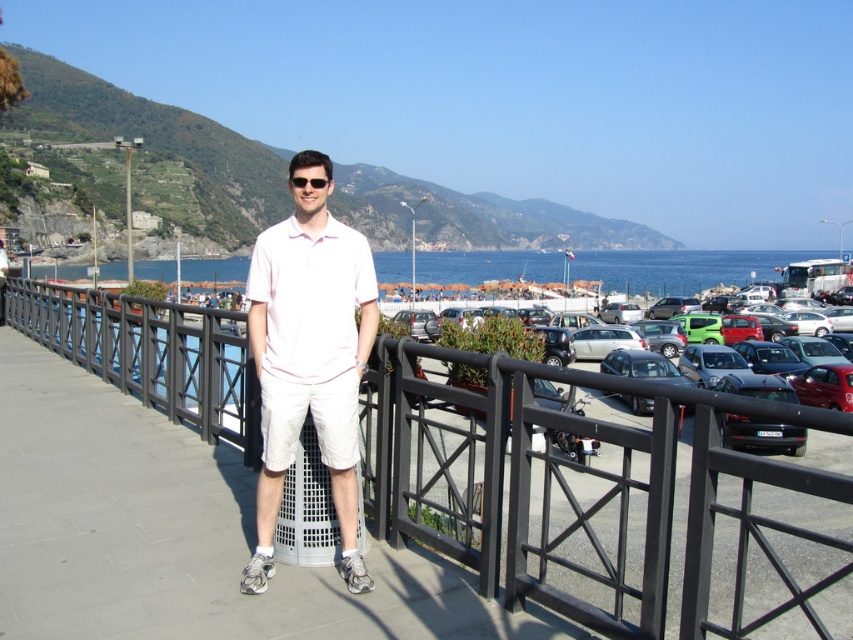
You are standing at the point closer to the camera in the image. Which point are you at, point (556, 492) or point (782, 404)?

You are at point (556, 492) because it is further to the camera than point (782, 404).